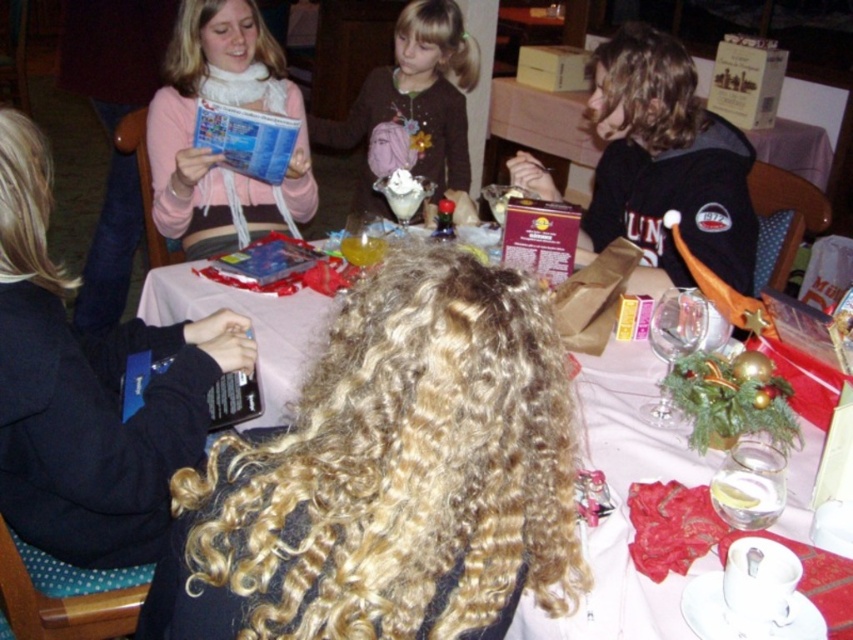
Question: Does smooth white table at center appear over brown cotton shirt at upper center?

Choices:
 (A) no
 (B) yes

Answer: (A)

Question: Which of these objects is positioned closest to the brown cardboard box at center?

Choices:
 (A) matte pink sweater at upper left
 (B) matte pink scarf at upper left

Answer: (A)

Question: Is wooden table at center above brown cardboard box at center?

Choices:
 (A) no
 (B) yes

Answer: (B)

Question: Considering the relative positions of matte pink sweater at upper left and dark brown hair at right in the image provided, where is matte pink sweater at upper left located with respect to dark brown hair at right?

Choices:
 (A) right
 (B) left

Answer: (B)

Question: Which of the following is the closest to the observer?

Choices:
 (A) matte pink sweater at upper left
 (B) dark brown hair at right

Answer: (A)

Question: Which of the following is the closest to the observer?

Choices:
 (A) matte pink scarf at upper left
 (B) wooden table at center
 (C) brown cotton shirt at upper center
 (D) matte pink sweater at upper left

Answer: (D)